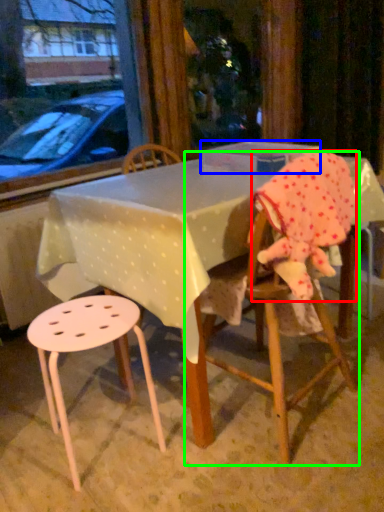
Question: Based on their relative distances, which object is nearer to toddler (highlighted by a red box)? Choose from box (highlighted by a blue box) and chair (highlighted by a green box).

Choices:
 (A) box
 (B) chair

Answer: (B)